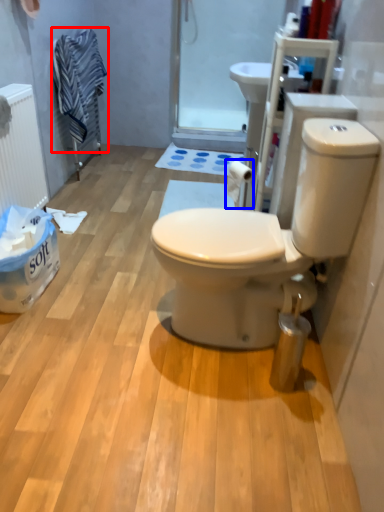
Question: Which point is further to the camera, laundry (highlighted by a red box) or toilet paper (highlighted by a blue box)?

Choices:
 (A) laundry
 (B) toilet paper

Answer: (A)